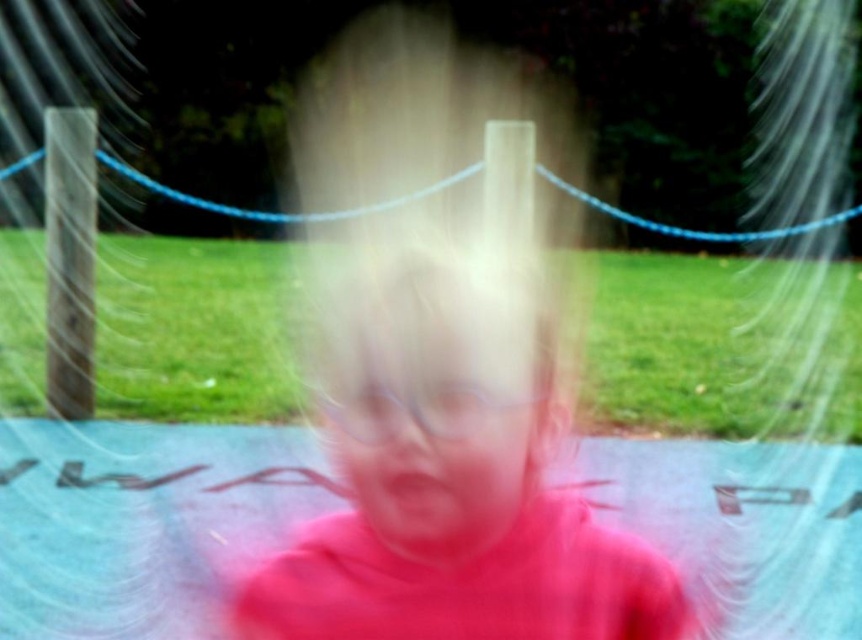
Question: Among these objects, which one is farthest from the camera?

Choices:
 (A) pink matte shirt at center
 (B) pink matte face at center

Answer: (A)

Question: Is pink matte shirt at center bigger than pink matte face at center?

Choices:
 (A) yes
 (B) no

Answer: (A)

Question: Does pink matte shirt at center appear on the right side of pink matte face at center?

Choices:
 (A) no
 (B) yes

Answer: (A)

Question: Among these objects, which one is farthest from the camera?

Choices:
 (A) pink matte face at center
 (B) pink matte shirt at center

Answer: (B)

Question: Observing the image, what is the correct spatial positioning of pink matte shirt at center in reference to pink matte face at center?

Choices:
 (A) left
 (B) right

Answer: (A)